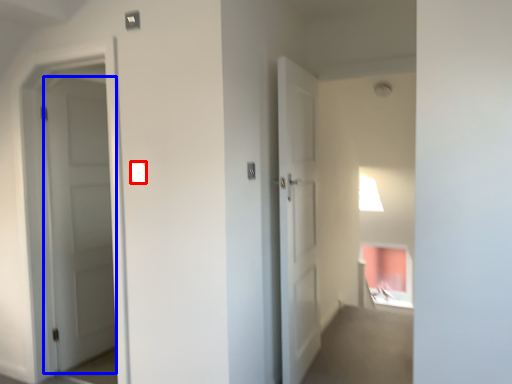
Question: Which point is further to the camera, light switch (highlighted by a red box) or door (highlighted by a blue box)?

Choices:
 (A) light switch
 (B) door

Answer: (B)